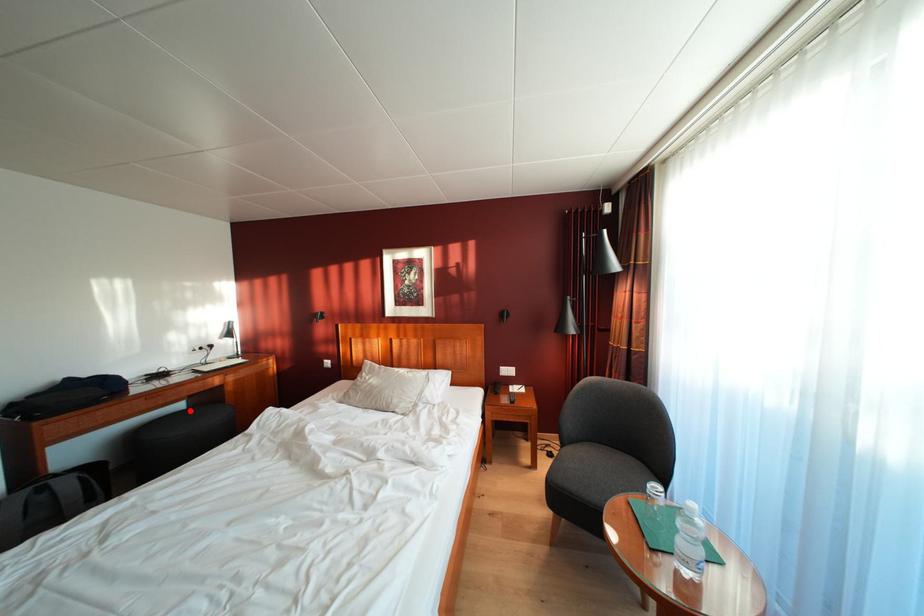
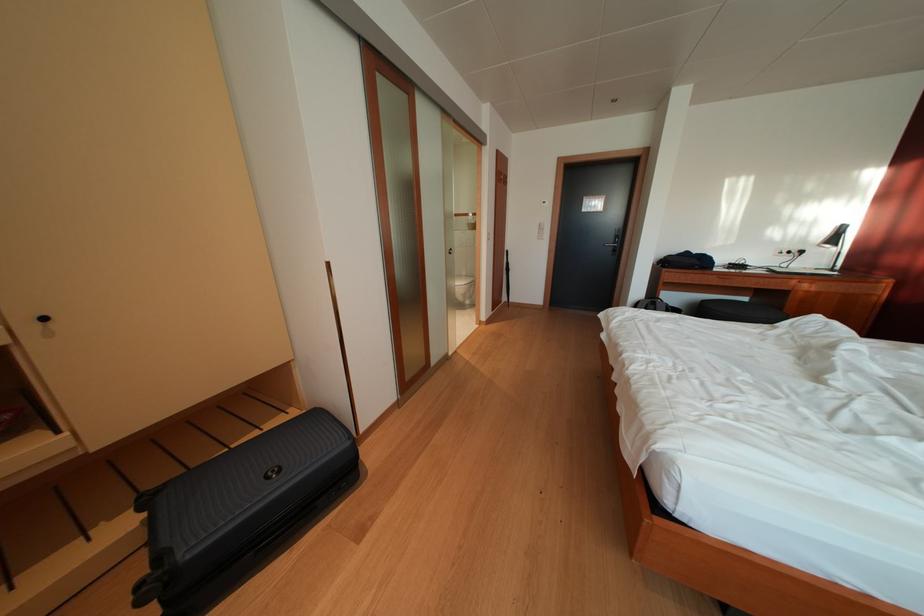
Question: A red point is marked in image1. In image2, is the corresponding 3D point closer to the camera or farther? Reply with the corresponding letter.

Choices:
 (A) The corresponding 3D point is closer.
 (B) The corresponding 3D point is farther.

Answer: (A)